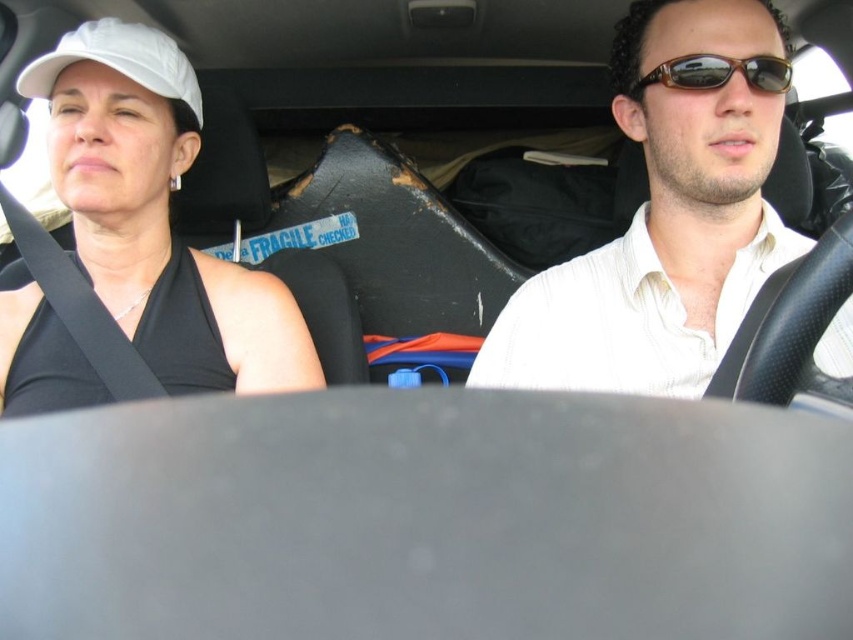
What are the coordinates of the matte black tank top at left?

The matte black tank top at left is located at point (x=138, y=243).

You are a passenger in the car and want to hand a tissue to the person wearing the matte black tank top at left. Which direction should you reach to avoid touching the white shirt at center?

You should reach to the left side to avoid the white shirt at center since the matte black tank top at left is positioned below it, and the white shirt at center is above.

You are a passenger in the car and want to reach a point in the car that is located at point [32,330]. There is another point at point [688,324] in front of it. Which direction should you move to reach the desired point?

To reach point [32,330], you should move backward since point [688,324] is in front of it.